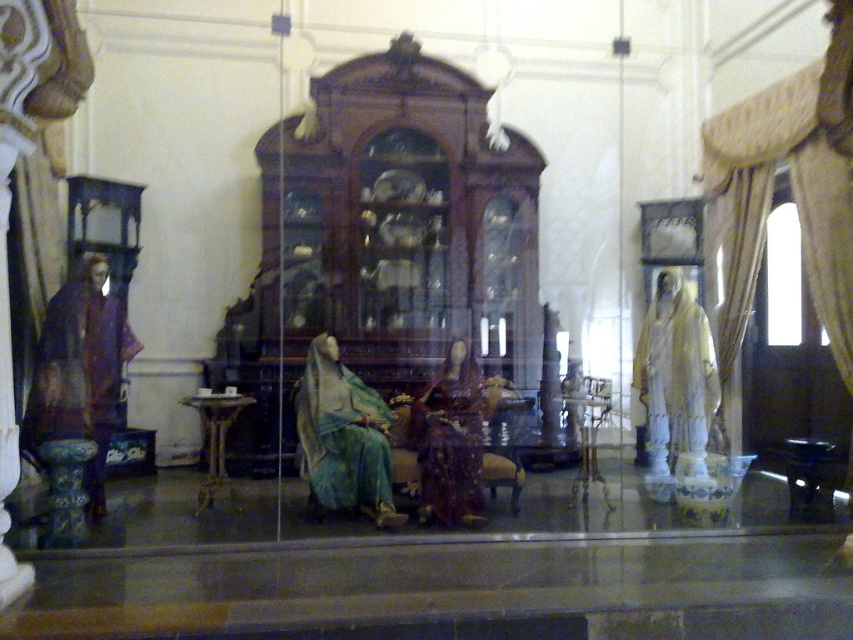
Question: From the image, what is the correct spatial relationship of white marble statue at right in relation to wooden pedestal table at center?

Choices:
 (A) right
 (B) left

Answer: (A)

Question: Which point is closer to the camera?

Choices:
 (A) matte brown fabric at center
 (B) white marble statue at right

Answer: (A)

Question: Which point is farther to the camera?

Choices:
 (A) (218, 413)
 (B) (712, 353)
 (C) (344, 387)

Answer: (B)

Question: Which of the following is the closest to the observer?

Choices:
 (A) white marble statue at right
 (B) matte green fabric at center

Answer: (B)

Question: In this image, where is white marble statue at right located relative to matte brown fabric at center?

Choices:
 (A) above
 (B) below

Answer: (A)

Question: Is matte purple robe at left in front of white marble statue at right?

Choices:
 (A) no
 (B) yes

Answer: (B)